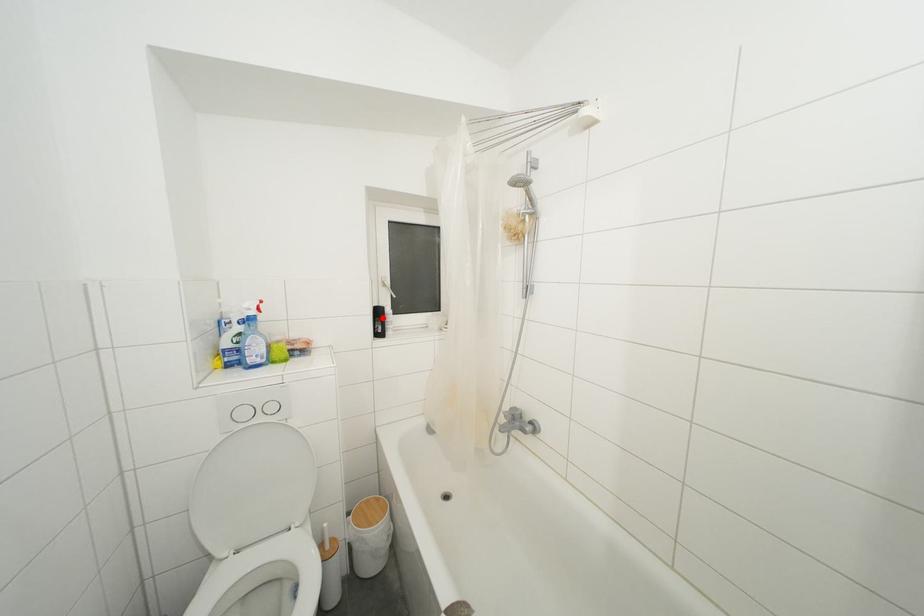
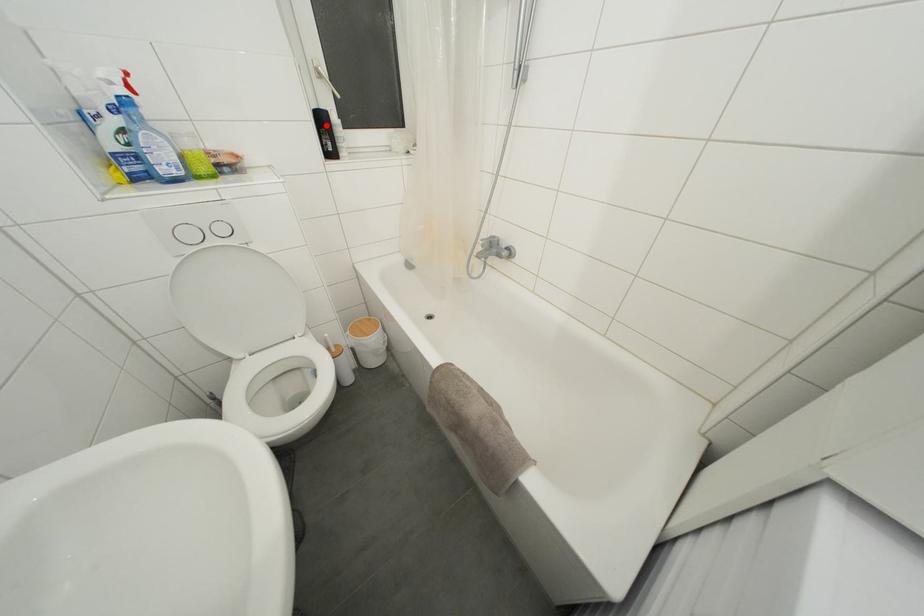
I am providing you with two images of the same scene from different viewpoints. A red point is marked on the first image and another point is marked on the second image. Is the red point in image1 aligned with the point shown in image2?

Yes